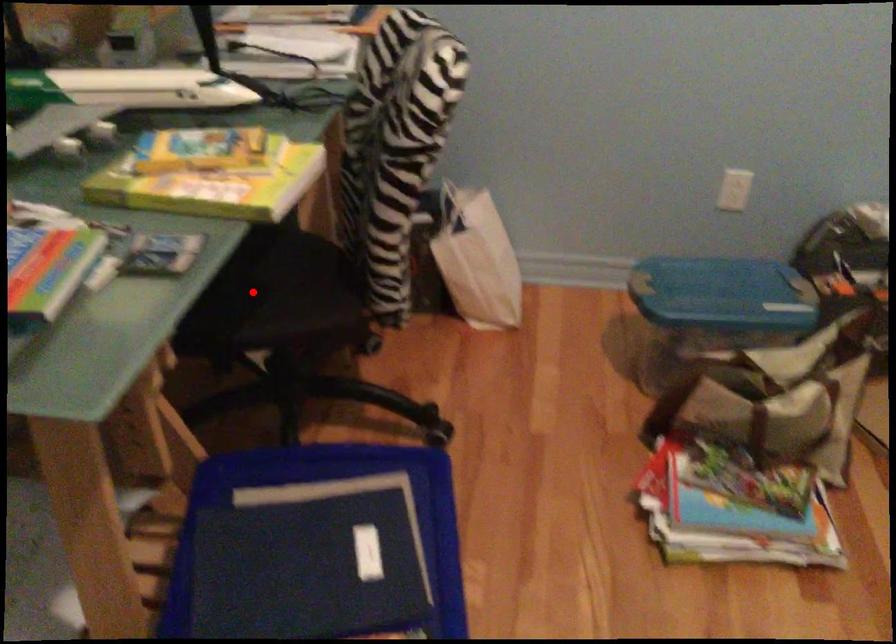
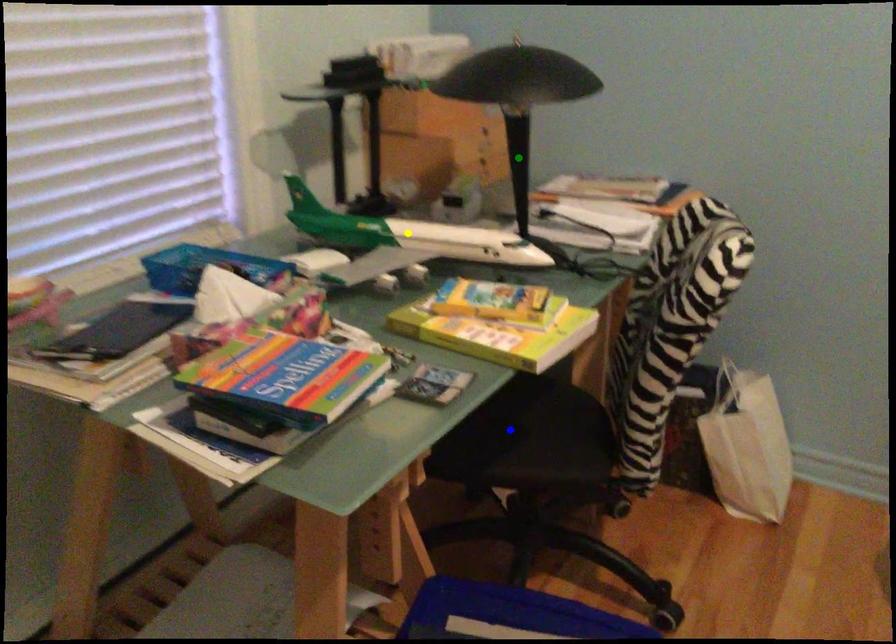
Question: I am providing you with two images of the same scene from different viewpoints. A red point is marked on the first image. You are given multiple points on the second image. Which spot in image 2 lines up with the point in image 1?

Choices:
 (A) green point
 (B) yellow point
 (C) blue point

Answer: (C)